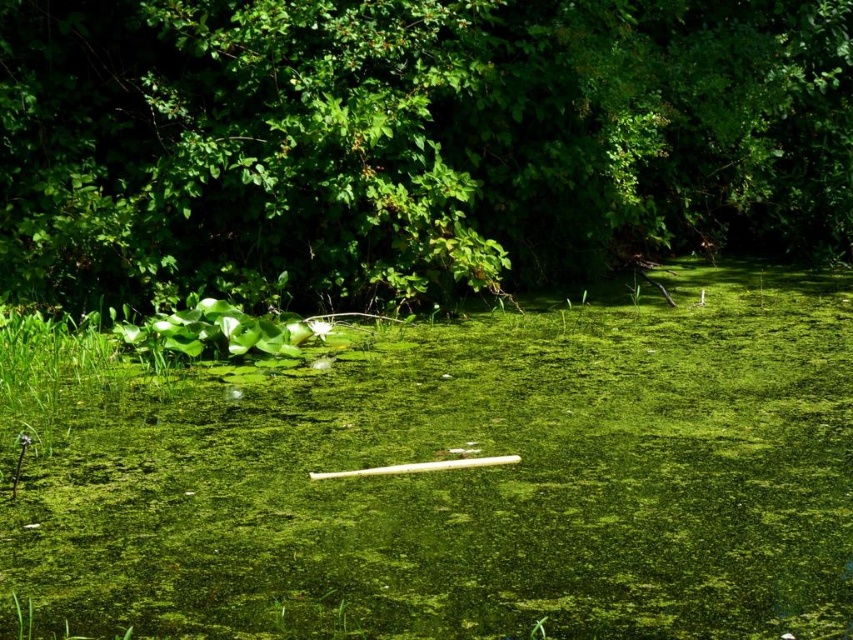
Which is more to the left, green algae-covered water at center or green leafy tree at upper center?

Positioned to the left is green leafy tree at upper center.

Who is more forward, (373, 396) or (776, 20)?

Point (373, 396)

At what (x,y) coordinates should I click in order to perform the action: click on green algae-covered water at center. Please return your answer as a coordinate pair (x, y). The height and width of the screenshot is (640, 853). Looking at the image, I should click on click(473, 483).